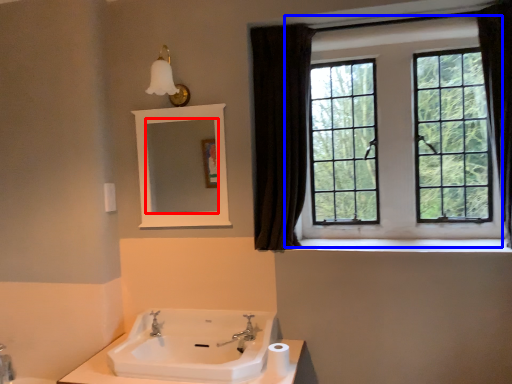
Question: Which object appears farthest to the camera in this image, mirror (highlighted by a red box) or window (highlighted by a blue box)?

Choices:
 (A) mirror
 (B) window

Answer: (A)